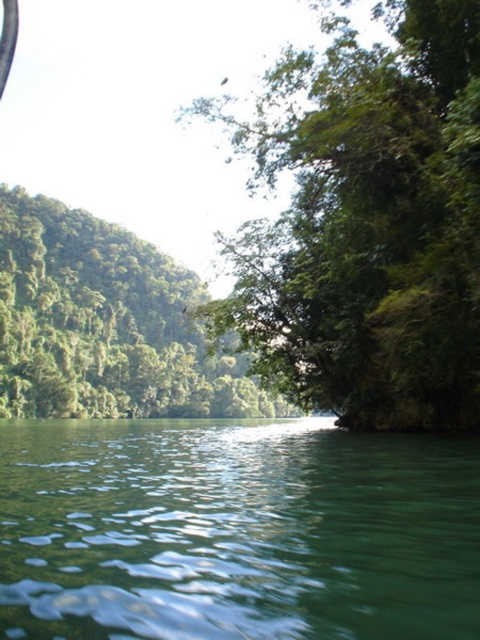
You are standing on a boat and looking at the green smooth water at lower left and the green leafy tree at left. Which object is closer to the water surface?

The green smooth water at lower left is closer to the water surface than the green leafy tree at left because it is shorter.